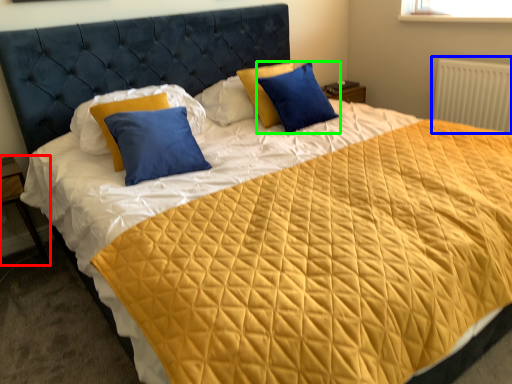
Question: Considering the real-world distances, which object is farthest from nightstand (highlighted by a red box)? radiator (highlighted by a blue box) or pillow (highlighted by a green box)?

Choices:
 (A) radiator
 (B) pillow

Answer: (A)